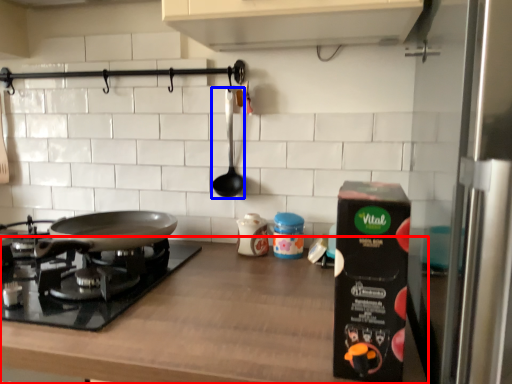
Question: Which of the following is the farthest to the observer, countertop (highlighted by a red box) or utensil (highlighted by a blue box)?

Choices:
 (A) countertop
 (B) utensil

Answer: (B)